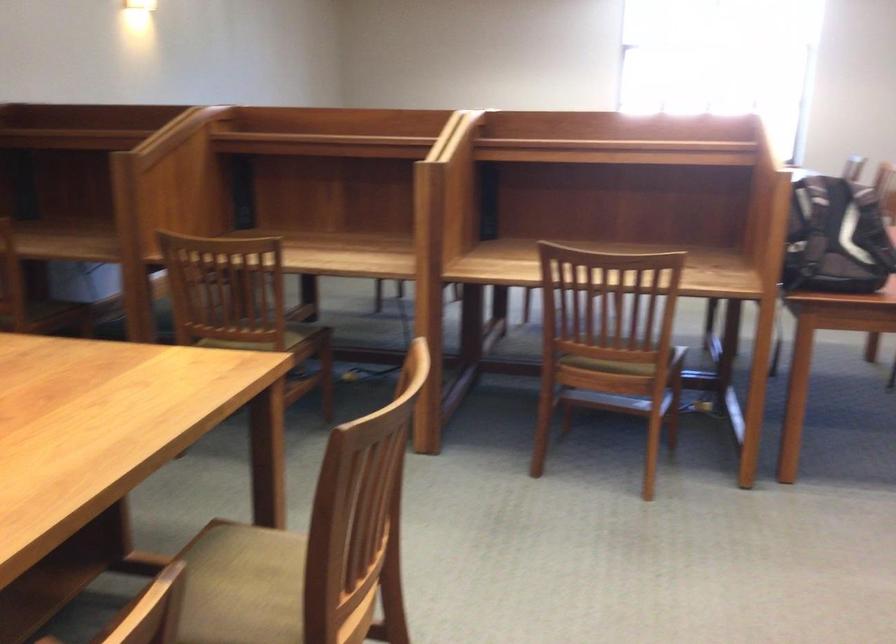
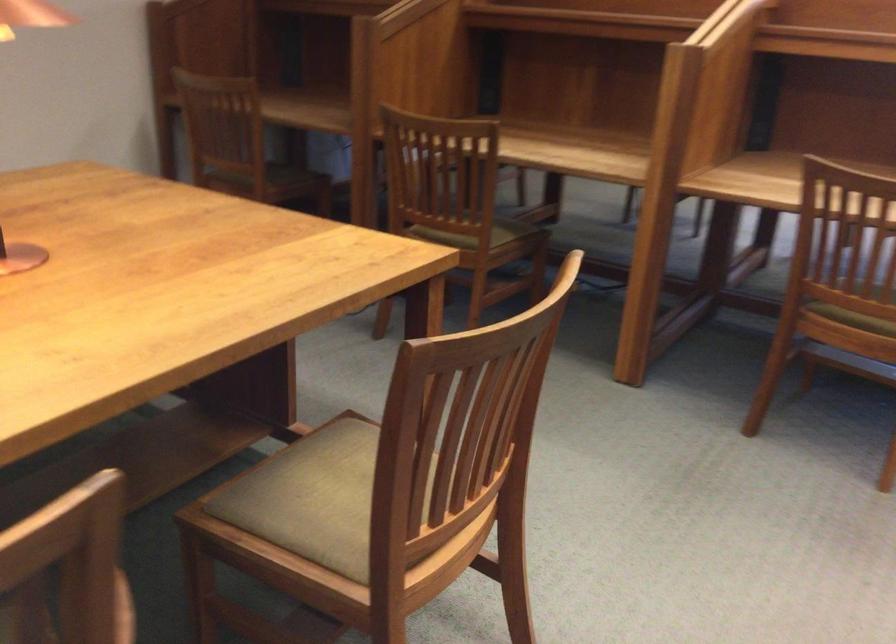
Find the pixel in the second image that matches [599,363] in the first image.

(855, 313)